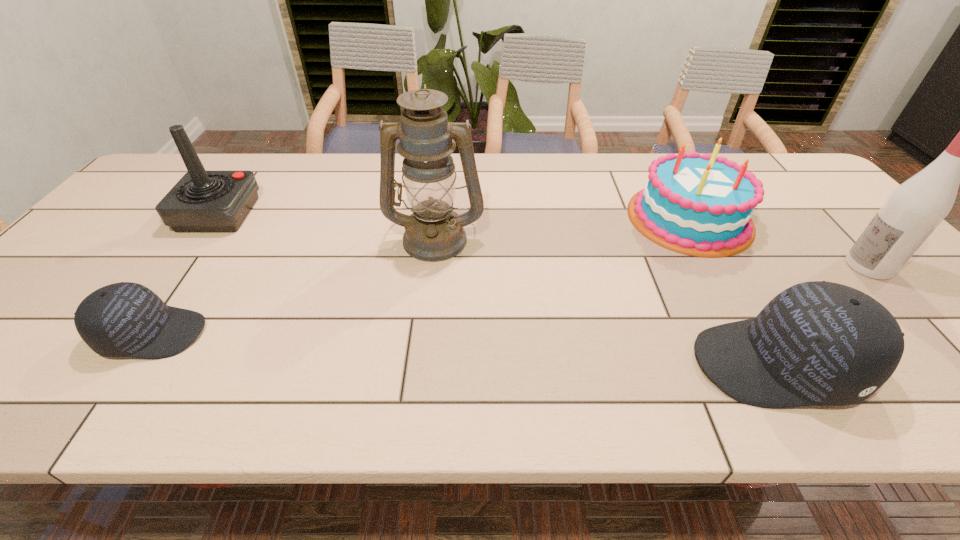
Identify the location of vacant spot for a new baseball_cap to ensure equal spacing. The height and width of the screenshot is (540, 960). (455, 348).